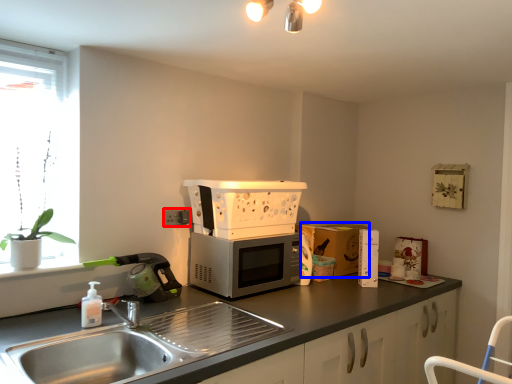
Question: Which object appears closest to the camera in this image, electric outlet (highlighted by a red box) or cardboard box (highlighted by a blue box)?

Choices:
 (A) electric outlet
 (B) cardboard box

Answer: (A)